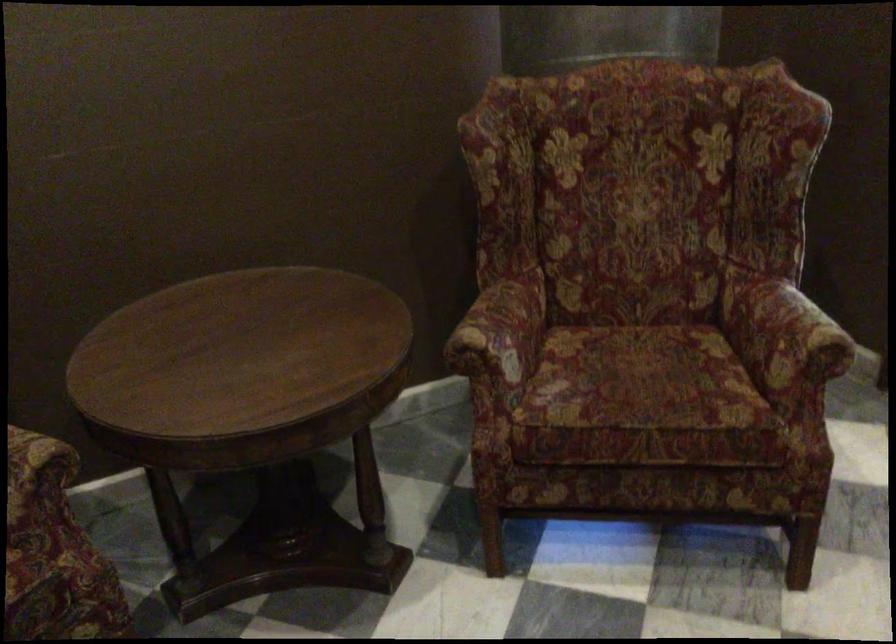
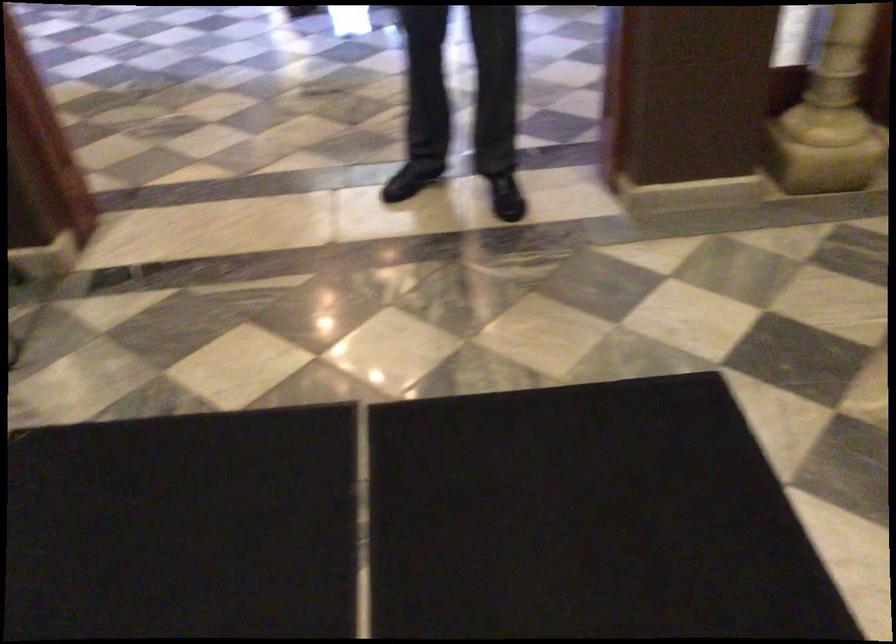
First-person continuous shooting, in which direction is the camera rotating?

The rotation direction of the camera is left-down.